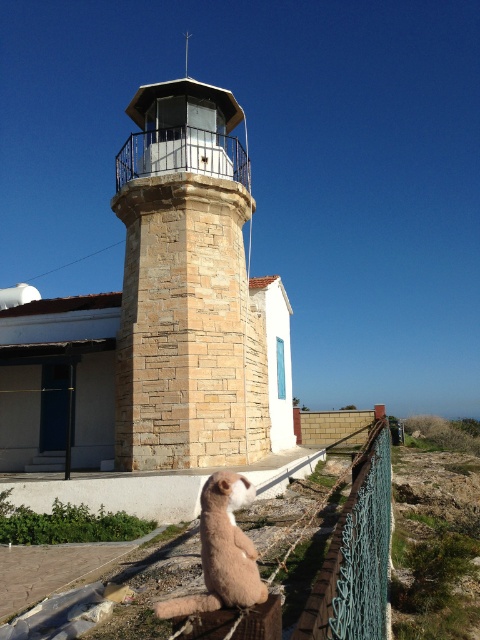
Question: Among these points, which one is nearest to the camera?

Choices:
 (A) (144, 392)
 (B) (358, 614)
 (C) (250, 486)

Answer: (B)

Question: Considering the real-world distances, which object is closest to the fuzzy beige cat at lower center?

Choices:
 (A) green wire mesh at right
 (B) stone textured tower at center

Answer: (A)

Question: Can you confirm if stone textured tower at center is positioned to the right of green wire mesh at right?

Choices:
 (A) no
 (B) yes

Answer: (A)

Question: In this image, where is stone textured tower at center located relative to green wire mesh at right?

Choices:
 (A) below
 (B) above

Answer: (B)

Question: Is stone textured tower at center wider than green wire mesh at right?

Choices:
 (A) no
 (B) yes

Answer: (A)

Question: Among these objects, which one is nearest to the camera?

Choices:
 (A) stone textured tower at center
 (B) green wire mesh at right

Answer: (B)